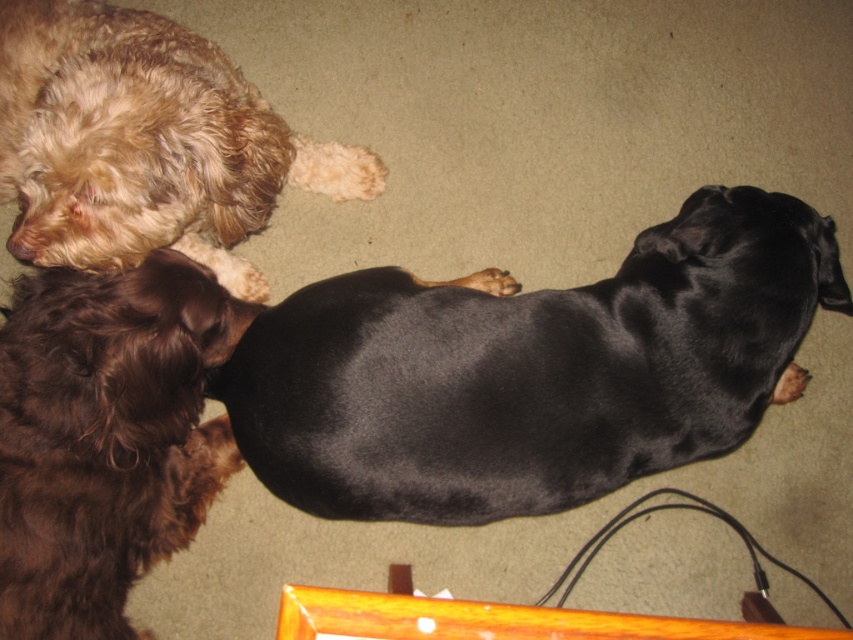
Question: From the image, what is the correct spatial relationship of black smooth dog at center in relation to shaggy golden fur at upper left?

Choices:
 (A) left
 (B) right

Answer: (B)

Question: Is black smooth dog at center positioned before brown fuzzy dog at left?

Choices:
 (A) no
 (B) yes

Answer: (A)

Question: Considering the real-world distances, which object is farthest from the shaggy golden fur at upper left?

Choices:
 (A) black smooth dog at center
 (B) brown fuzzy dog at left

Answer: (A)

Question: Where is black smooth dog at center located in relation to brown fuzzy dog at left in the image?

Choices:
 (A) below
 (B) above

Answer: (B)

Question: Which of the following is the closest to the observer?

Choices:
 (A) black smooth dog at center
 (B) brown fuzzy dog at left

Answer: (B)

Question: Which point appears farthest from the camera in this image?

Choices:
 (A) (33, 522)
 (B) (270, 113)

Answer: (B)